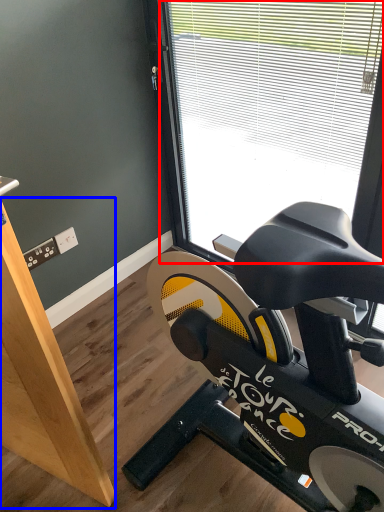
Question: Which object is further to the camera taking this photo, window (highlighted by a red box) or plywood (highlighted by a blue box)?

Choices:
 (A) window
 (B) plywood

Answer: (A)